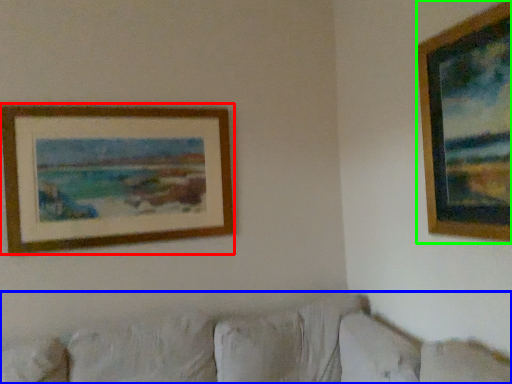
Question: Estimate the real-world distances between objects in this image. Which object is farther from picture frame (highlighted by a red box), couch (highlighted by a blue box) or picture frame (highlighted by a green box)?

Choices:
 (A) couch
 (B) picture frame

Answer: (B)